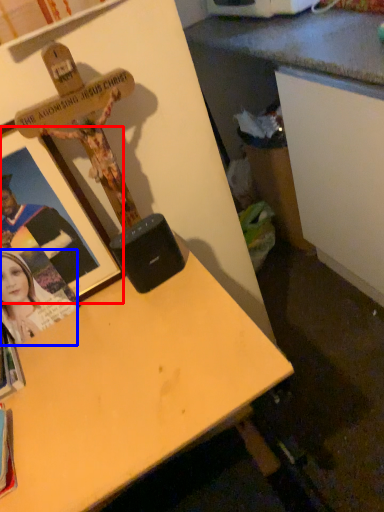
Question: Which object is further to the camera taking this photo, picture frame (highlighted by a red box) or person (highlighted by a blue box)?

Choices:
 (A) picture frame
 (B) person

Answer: (B)